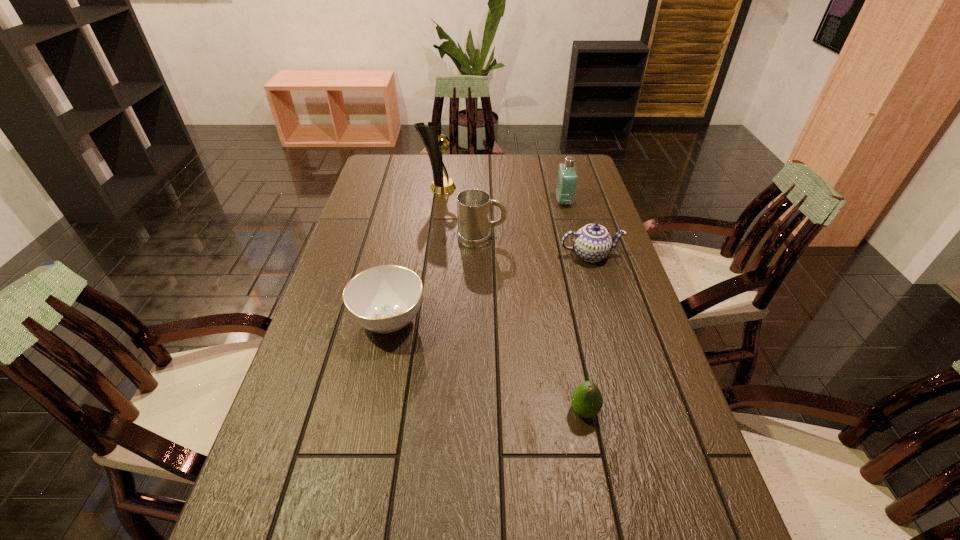
Find the location of a particular element. This screenshot has height=540, width=960. vacant space at the left edge of the desktop is located at coordinates (334, 319).

In the image, there is a desktop. At what (x,y) coordinates should I click in order to perform the action: click on vacant space at the right edge. Please return your answer as a coordinate pair (x, y). Looking at the image, I should click on (621, 270).

Identify the location of vacant space at the far left corner of the desktop. This screenshot has width=960, height=540. (404, 173).

You are a GUI agent. You are given a task and a screenshot of the screen. Output one action in this format:
    pyautogui.click(x=<x>, y=<y>)
    Task: Click on the blank space at the far right corner of the desktop
    This screenshot has width=960, height=540.
    Given the screenshot: What is the action you would take?
    pyautogui.click(x=557, y=175)

Find the location of a particular element. This screenshot has width=960, height=540. free space between the mug and the right chinaware is located at coordinates (536, 246).

Where is `free point between the perfume and the fourth object from right to left`? free point between the perfume and the fourth object from right to left is located at coordinates (522, 219).

The height and width of the screenshot is (540, 960). I want to click on free space between the mug and the perfume, so click(x=522, y=219).

Where is `empty space between the perfume and the right chinaware`? empty space between the perfume and the right chinaware is located at coordinates (577, 228).

Where is `empty location between the nearest object and the right chinaware`? empty location between the nearest object and the right chinaware is located at coordinates (588, 333).

Find the location of a particular element. This screenshot has height=540, width=960. empty space between the award and the right chinaware is located at coordinates (515, 221).